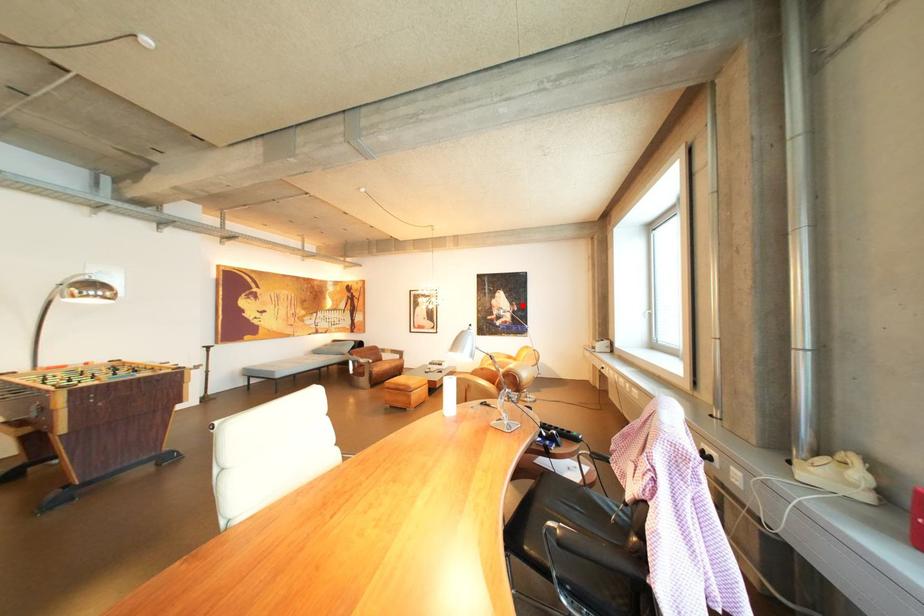
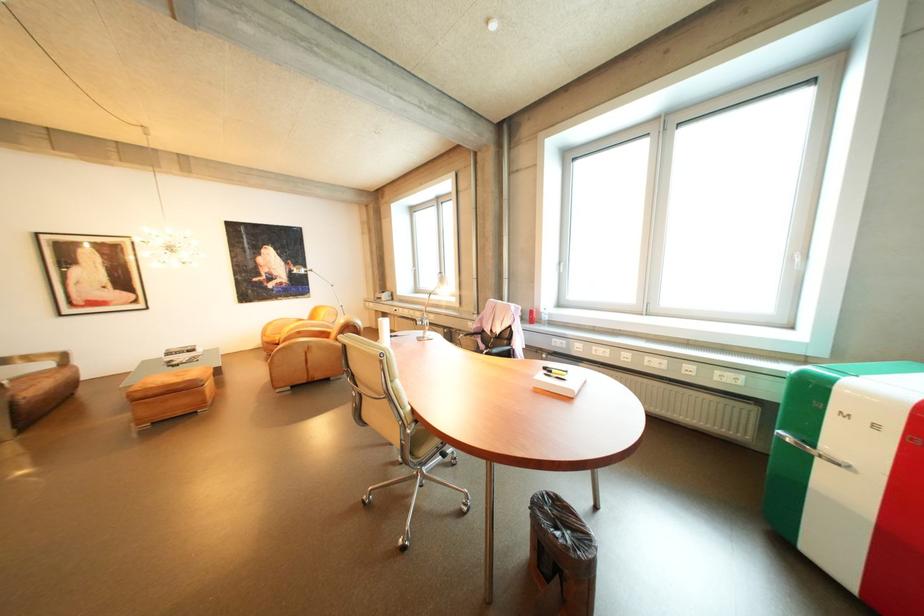
Where in the second image is the point corresponding to the highlighted location from the first image?

(296, 264)